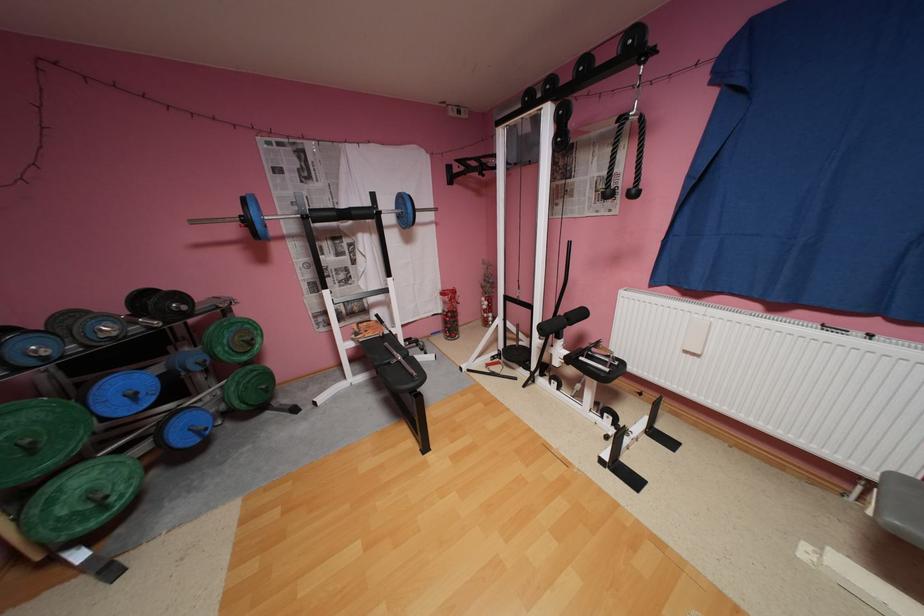
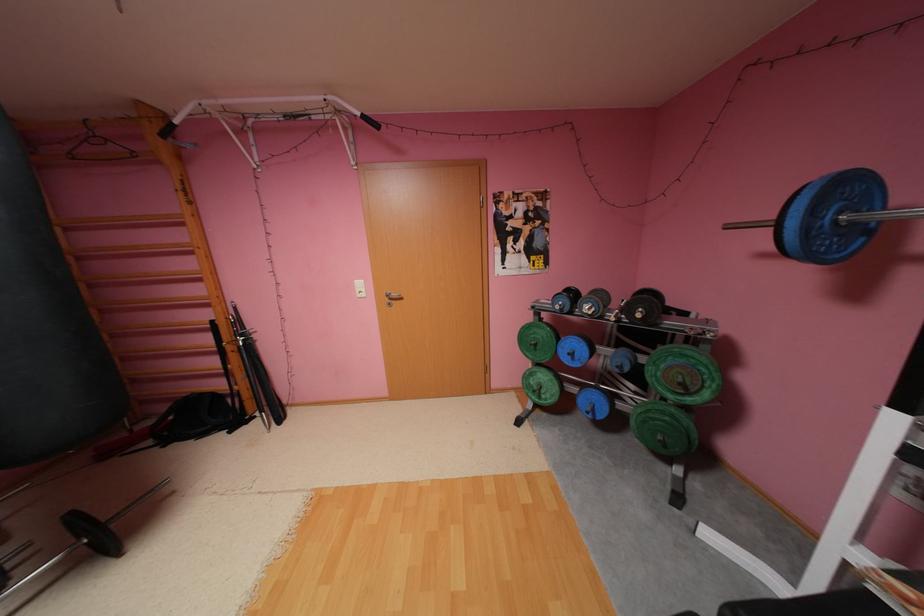
In the second image, find the point that corresponds to (x=193, y=308) in the first image.

(648, 315)